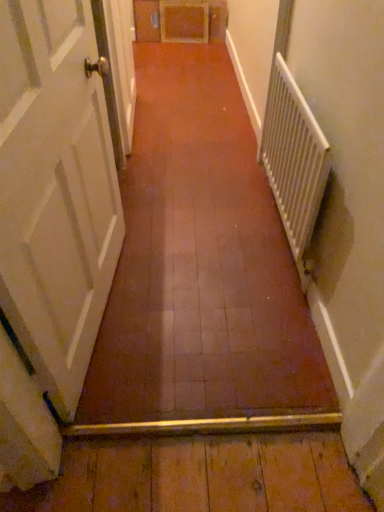
Question: Is white metallic radiator at right to the left or to the right of white painted wood door at left in the image?

Choices:
 (A) left
 (B) right

Answer: (B)

Question: From a real-world perspective, is white metallic radiator at right positioned above or below white painted wood door at left?

Choices:
 (A) below
 (B) above

Answer: (A)

Question: Is white metallic radiator at right spatially inside white painted wood door at left, or outside of it?

Choices:
 (A) outside
 (B) inside

Answer: (A)

Question: From the image's perspective, is white painted wood door at left above or below white metallic radiator at right?

Choices:
 (A) below
 (B) above

Answer: (A)

Question: Choose the correct answer: Is white painted wood door at left inside white metallic radiator at right or outside it?

Choices:
 (A) inside
 (B) outside

Answer: (B)

Question: Looking at the image, does white painted wood door at left seem bigger or smaller compared to white metallic radiator at right?

Choices:
 (A) small
 (B) big

Answer: (B)

Question: Is white painted wood door at left wider or thinner than white metallic radiator at right?

Choices:
 (A) thin
 (B) wide

Answer: (B)